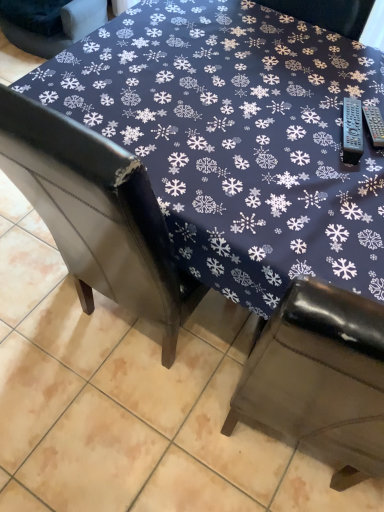
The width and height of the screenshot is (384, 512). What are the coordinates of `dark blue fabric tablecloth at center` in the screenshot? It's located at (237, 139).

In order to face dark blue fabric tablecloth at center, should I rotate leftwards or rightwards?

A 5.355 degree turn to the left will do.

Consider the image. Measure the distance between dark blue fabric tablecloth at center and camera.

31.07 inches.

Describe the element at coordinates (237, 139) in the screenshot. This screenshot has width=384, height=512. I see `dark blue fabric tablecloth at center` at that location.

You are a GUI agent. You are given a task and a screenshot of the screen. Output one action in this format:
    pyautogui.click(x=<x>, y=<y>)
    Task: Click on the dark leather chair at upper left
    The height and width of the screenshot is (512, 384).
    Given the screenshot: What is the action you would take?
    (63, 28)

Describe the element at coordinates (63, 28) in the screenshot. I see `dark leather chair at upper left` at that location.

Measure the distance between dark leather chair at upper left and camera.

The distance of dark leather chair at upper left from camera is 2.34 meters.

Where is `dark blue fabric tablecloth at center`? This screenshot has width=384, height=512. dark blue fabric tablecloth at center is located at coordinates (237, 139).

Between dark blue fabric tablecloth at center and dark leather chair at upper left, which one appears on the right side from the viewer's perspective?

From the viewer's perspective, dark blue fabric tablecloth at center appears more on the right side.

Which object is closer to the camera taking this photo, dark blue fabric tablecloth at center or dark leather chair at upper left?

dark blue fabric tablecloth at center.

Which is behind, point (150, 51) or point (72, 25)?

Positioned behind is point (72, 25).

From the picture: From the image's perspective, is dark blue fabric tablecloth at center above dark leather chair at upper left?

Actually, dark blue fabric tablecloth at center appears below dark leather chair at upper left in the image.

From a real-world perspective, is dark blue fabric tablecloth at center above or below dark leather chair at upper left?

In terms of real-world spatial position, dark blue fabric tablecloth at center is above dark leather chair at upper left.

Is dark blue fabric tablecloth at center wider than dark leather chair at upper left?

Indeed, dark blue fabric tablecloth at center has a greater width compared to dark leather chair at upper left.

Does dark blue fabric tablecloth at center have a lesser height compared to dark leather chair at upper left?

No, dark blue fabric tablecloth at center is not shorter than dark leather chair at upper left.

Between dark blue fabric tablecloth at center and dark leather chair at upper left, which one has smaller size?

dark leather chair at upper left.

Is dark blue fabric tablecloth at center positioned beyond the bounds of dark leather chair at upper left?

Yes, dark blue fabric tablecloth at center is outside of dark leather chair at upper left.

Is dark blue fabric tablecloth at center not near dark leather chair at upper left?

Yes, dark blue fabric tablecloth at center and dark leather chair at upper left are located far from each other.

Does dark blue fabric tablecloth at center turn towards dark leather chair at upper left?

No, dark blue fabric tablecloth at center does not turn towards dark leather chair at upper left.

Measure the distance between dark blue fabric tablecloth at center and dark leather chair at upper left.

1.58 meters.

Find the location of a particular element. The height and width of the screenshot is (512, 384). table located in front of the dark leather chair at upper left is located at coordinates (237, 139).

Which is more to the right, dark leather chair at upper left or dark blue fabric tablecloth at center?

From the viewer's perspective, dark blue fabric tablecloth at center appears more on the right side.

Which object is closer to the camera taking this photo, dark leather chair at upper left or dark blue fabric tablecloth at center?

dark blue fabric tablecloth at center.

Does point (55, 40) come in front of point (285, 170)?

No, (55, 40) is further to viewer.

From the image's perspective, between dark leather chair at upper left and dark blue fabric tablecloth at center, who is located below?

dark blue fabric tablecloth at center.

From a real-world perspective, is dark leather chair at upper left physically above dark blue fabric tablecloth at center?

Actually, dark leather chair at upper left is physically below dark blue fabric tablecloth at center in the real world.

Considering the relative sizes of dark leather chair at upper left and dark blue fabric tablecloth at center in the image provided, is dark leather chair at upper left wider than dark blue fabric tablecloth at center?

Incorrect, the width of dark leather chair at upper left does not surpass that of dark blue fabric tablecloth at center.

Which of these two, dark leather chair at upper left or dark blue fabric tablecloth at center, stands shorter?

With less height is dark leather chair at upper left.

Does dark leather chair at upper left have a smaller size compared to dark blue fabric tablecloth at center?

Correct, dark leather chair at upper left occupies less space than dark blue fabric tablecloth at center.

Could dark blue fabric tablecloth at center be considered to be inside dark leather chair at upper left?

Actually, dark blue fabric tablecloth at center is outside dark leather chair at upper left.

Is dark leather chair at upper left far from dark blue fabric tablecloth at center?

Absolutely, dark leather chair at upper left is distant from dark blue fabric tablecloth at center.

Is dark leather chair at upper left oriented towards dark blue fabric tablecloth at center?

No, dark leather chair at upper left does not turn towards dark blue fabric tablecloth at center.

What's the angular difference between dark leather chair at upper left and dark blue fabric tablecloth at center's facing directions?

dark leather chair at upper left and dark blue fabric tablecloth at center are facing 175 degrees away from each other.

Measure the distance from dark leather chair at upper left to dark blue fabric tablecloth at center.

5.17 feet.

Identify the location of table on the right side of dark leather chair at upper left. The height and width of the screenshot is (512, 384). (237, 139).

Locate an element on the screen. This screenshot has width=384, height=512. table that appears on the right of dark leather chair at upper left is located at coordinates (237, 139).

Image resolution: width=384 pixels, height=512 pixels. Find the location of `table below the dark leather chair at upper left (from the image's perspective)`. table below the dark leather chair at upper left (from the image's perspective) is located at coordinates 237,139.